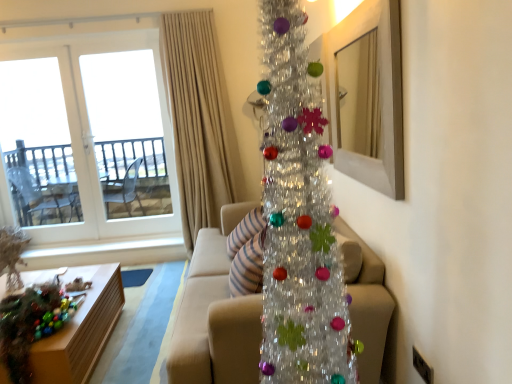
The image size is (512, 384). What do you see at coordinates (298, 219) in the screenshot?
I see `shiny metallic christmas tree at center` at bounding box center [298, 219].

Describe the element at coordinates (88, 137) in the screenshot. This screenshot has height=384, width=512. I see `transparent glass door at upper left` at that location.

Where is `shiny metallic christmas tree at center`? The image size is (512, 384). shiny metallic christmas tree at center is located at coordinates (298, 219).

Which is in front, beige fabric curtain at upper center or shiny metallic christmas tree at center?

shiny metallic christmas tree at center is in front.

What's the angular difference between beige fabric curtain at upper center and shiny metallic christmas tree at center's facing directions?

The angular difference between beige fabric curtain at upper center and shiny metallic christmas tree at center is 88.8 degrees.

Is point (214, 127) less distant than point (347, 378)?

No, it is behind (347, 378).

I want to click on curtain on the left of shiny metallic christmas tree at center, so click(x=198, y=119).

Locate an element on the screen. This screenshot has width=512, height=384. picture frame that is above the beige fabric couch at center (from the image's perspective) is located at coordinates (379, 95).

Between wooden mirror at upper right and beige fabric couch at center, which one appears on the left side from the viewer's perspective?

Positioned to the left is beige fabric couch at center.

Which is further, (389,131) or (218,378)?

The point (218,378) is farther from the camera.

From the image's perspective, which one is positioned lower, shiny metallic christmas tree at center or beige fabric couch at center?

beige fabric couch at center appears lower in the image.

Between point (272, 379) and point (223, 331), which one is positioned in front?

The point (272, 379) is closer.

Between shiny metallic christmas tree at center and beige fabric couch at center, which one is positioned behind?

beige fabric couch at center is more distant.

Who is bigger, shiny metallic christmas tree at center or beige fabric couch at center?

beige fabric couch at center is bigger.

Does wooden table at lower left have a larger size compared to wooden mirror at upper right?

Indeed, wooden table at lower left has a larger size compared to wooden mirror at upper right.

Locate an element on the screen. picture frame in front of the wooden table at lower left is located at coordinates (379, 95).

Which is more to the left, wooden table at lower left or wooden mirror at upper right?

From the viewer's perspective, wooden table at lower left appears more on the left side.

Considering the points (44, 345) and (358, 40), which point is behind, point (44, 345) or point (358, 40)?

Point (358, 40)

Is wooden mirror at upper right bigger or smaller than wooden table at lower left?

Clearly, wooden mirror at upper right is smaller in size than wooden table at lower left.

Could you tell me if wooden mirror at upper right is facing wooden table at lower left?

No, wooden mirror at upper right is not aimed at wooden table at lower left.

Looking at this image, which object is closer to the camera taking this photo, wooden mirror at upper right or wooden table at lower left?

wooden mirror at upper right is closer to the camera.

From the image's perspective, does wooden mirror at upper right appear lower than wooden table at lower left?

Incorrect, from the image's perspective, wooden mirror at upper right is higher than wooden table at lower left.

Is wooden table at lower left inside the boundaries of beige fabric curtain at upper center, or outside?

wooden table at lower left lies outside beige fabric curtain at upper center.

From the picture: Is wooden table at lower left to the left or to the right of beige fabric curtain at upper center in the image?

From the image, it's evident that wooden table at lower left is to the left of beige fabric curtain at upper center.

Relative to beige fabric curtain at upper center, is wooden table at lower left in front or behind?

wooden table at lower left is positioned closer to the viewer than beige fabric curtain at upper center.

Identify the location of table that appears in front of the beige fabric curtain at upper center. (81, 329).

Does point (248, 358) lie in front of point (391, 182)?

No, it is behind (391, 182).

Is beige fabric couch at center facing away from wooden mirror at upper right?

That's not correct — beige fabric couch at center is not looking away from wooden mirror at upper right.

Which is more to the right, beige fabric couch at center or wooden mirror at upper right?

From the viewer's perspective, wooden mirror at upper right appears more on the right side.

Would you say beige fabric couch at center is a long distance from wooden mirror at upper right?

No, beige fabric couch at center is not far from wooden mirror at upper right.

Where is `curtain behind the shiny metallic christmas tree at center`? curtain behind the shiny metallic christmas tree at center is located at coordinates (198, 119).

What are the coordinates of `studio couch below the wooden mirror at upper right (from a real-world perspective)` in the screenshot? It's located at (216, 315).

Based on their spatial positions, is wooden table at lower left or beige fabric curtain at upper center closer to wooden mirror at upper right?

Based on the image, beige fabric curtain at upper center appears to be nearer to wooden mirror at upper right.

Based on their spatial positions, is beige fabric couch at center or wooden table at lower left further from wooden mirror at upper right?

Based on the image, wooden table at lower left appears to be further to wooden mirror at upper right.

When comparing their distances from shiny metallic christmas tree at center, does transparent glass door at upper left or beige fabric curtain at upper center seem further?

transparent glass door at upper left lies further to shiny metallic christmas tree at center than the other object.

Considering their positions, is beige fabric curtain at upper center positioned closer to wooden table at lower left than transparent glass door at upper left?

Based on the image, beige fabric curtain at upper center appears to be nearer to wooden table at lower left.

Which object lies further to the anchor point wooden table at lower left, beige fabric curtain at upper center or shiny metallic christmas tree at center?

shiny metallic christmas tree at center is positioned further to the anchor wooden table at lower left.

Estimate the real-world distances between objects in this image. Which object is closer to beige fabric couch at center, shiny metallic christmas tree at center or transparent glass door at upper left?

shiny metallic christmas tree at center is positioned closer to the anchor beige fabric couch at center.

In the scene shown: Which object lies further to the anchor point shiny metallic christmas tree at center, wooden table at lower left or wooden mirror at upper right?

Based on the image, wooden table at lower left appears to be further to shiny metallic christmas tree at center.

Estimate the real-world distances between objects in this image. Which object is closer to wooden mirror at upper right, shiny metallic christmas tree at center or transparent glass door at upper left?

shiny metallic christmas tree at center.

Find the location of a particular element. table positioned between beige fabric couch at center and beige fabric curtain at upper center from near to far is located at coordinates (81, 329).

Identify the location of curtain positioned between shiny metallic christmas tree at center and transparent glass door at upper left from near to far. This screenshot has height=384, width=512. (198, 119).

This screenshot has height=384, width=512. In order to click on christmas tree between wooden table at lower left and wooden mirror at upper right from left to right in this screenshot , I will do `click(298, 219)`.

I want to click on studio couch between wooden table at lower left and wooden mirror at upper right, so click(x=216, y=315).